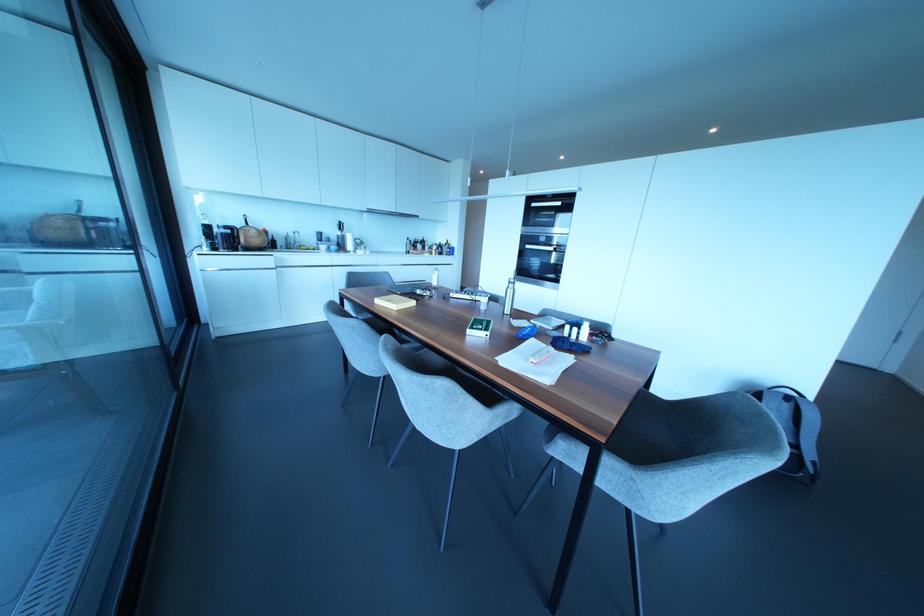
Where would you pull the oven door handle? Please return your answer as a coordinate pair (x, y).

(540, 248)